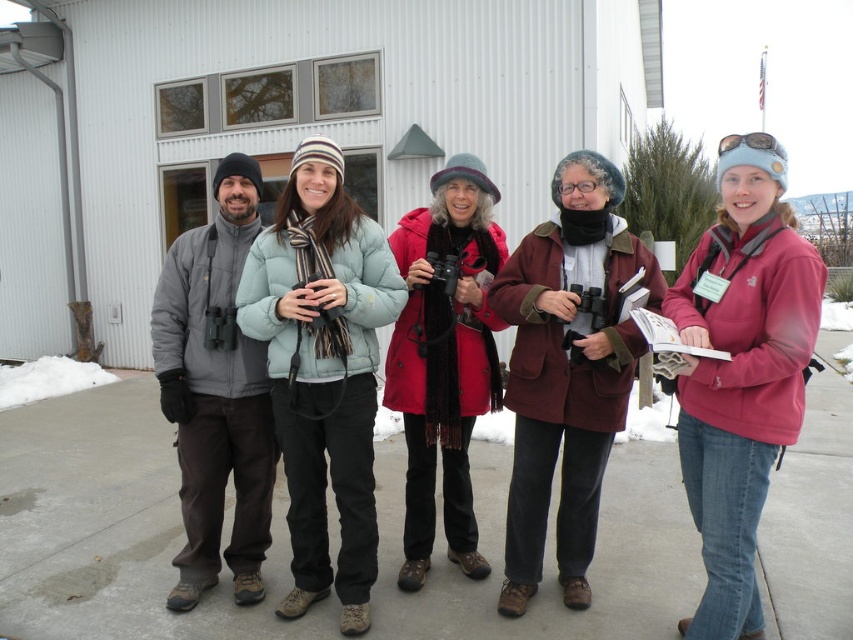
Does maroon woolen coat at center have a lesser width compared to red matte coat at center?

No.

Locate an element on the screen. maroon woolen coat at center is located at coordinates (567, 371).

I want to click on maroon woolen coat at center, so click(567, 371).

What do you see at coordinates (741, 371) in the screenshot? The height and width of the screenshot is (640, 853). I see `pink softshell jacket at center` at bounding box center [741, 371].

Is point (695, 388) farther from viewer compared to point (561, 349)?

No, (695, 388) is closer to viewer.

Is point (759, 280) positioned behind point (521, 452)?

No, it is not.

You are a GUI agent. You are given a task and a screenshot of the screen. Output one action in this format:
    pyautogui.click(x=<x>, y=<y>)
    Task: Click on the pink softshell jacket at center
    The height and width of the screenshot is (640, 853).
    Given the screenshot: What is the action you would take?
    pyautogui.click(x=741, y=371)

Find the location of a particular element. The width and height of the screenshot is (853, 640). pink softshell jacket at center is located at coordinates (741, 371).

Is pink softshell jacket at center below matte gray jacket at left?

Yes.

Who is more forward, (x=685, y=412) or (x=202, y=451)?

Positioned in front is point (x=685, y=412).

Where is `pink softshell jacket at center`? Image resolution: width=853 pixels, height=640 pixels. pink softshell jacket at center is located at coordinates (741, 371).